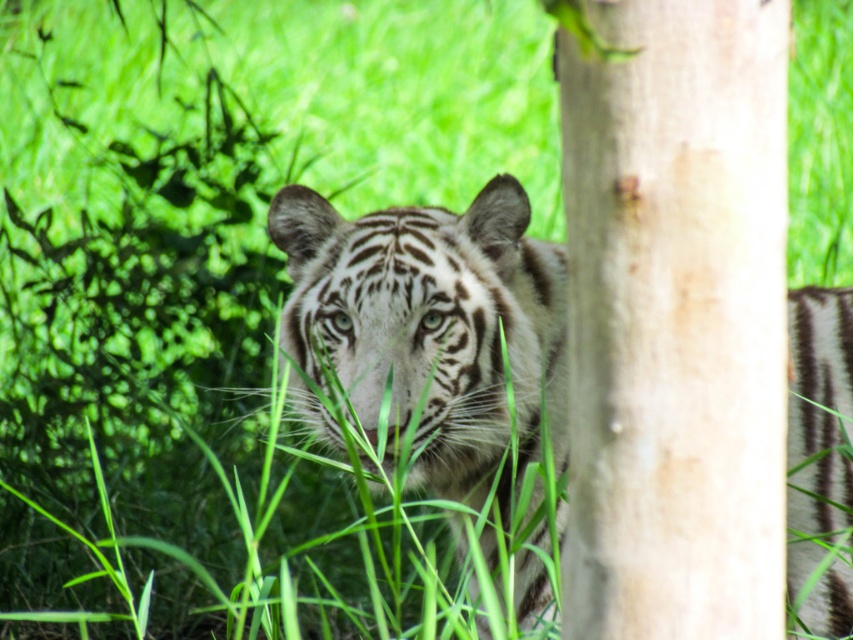
Question: Can you confirm if smooth brown tree trunk at center-right is bigger than white striped tiger at center?

Choices:
 (A) yes
 (B) no

Answer: (B)

Question: Is smooth brown tree trunk at center-right above white striped tiger at center?

Choices:
 (A) no
 (B) yes

Answer: (B)

Question: Does smooth brown tree trunk at center-right have a larger size compared to white striped tiger at center?

Choices:
 (A) no
 (B) yes

Answer: (A)

Question: Which of the following is the closest to the observer?

Choices:
 (A) (775, 362)
 (B) (837, 609)

Answer: (A)